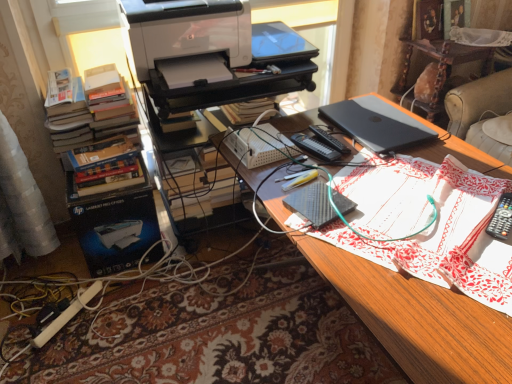
This screenshot has width=512, height=384. Find the location of `vacant space behind black plastic remote control at right`. vacant space behind black plastic remote control at right is located at coordinates (464, 185).